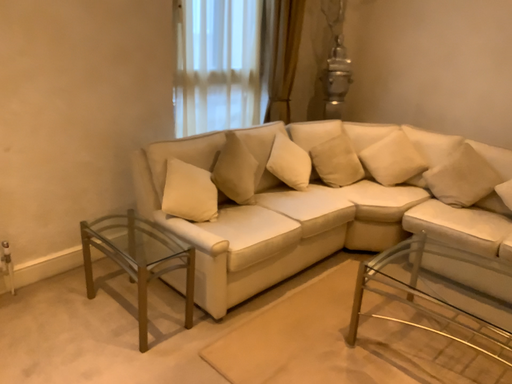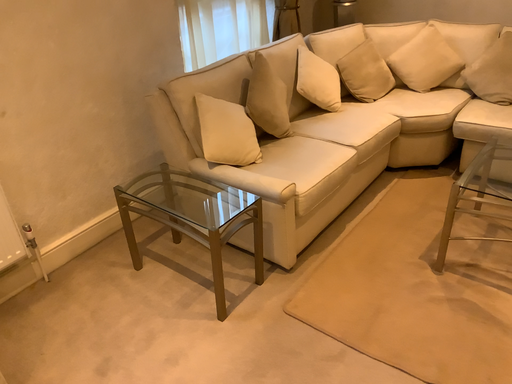
Question: How did the camera likely rotate when shooting the video?

Choices:
 (A) rotated downward
 (B) rotated upward

Answer: (A)